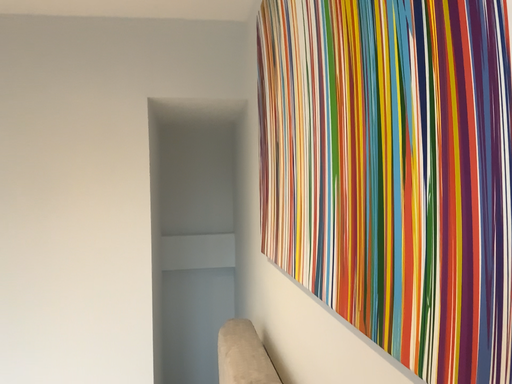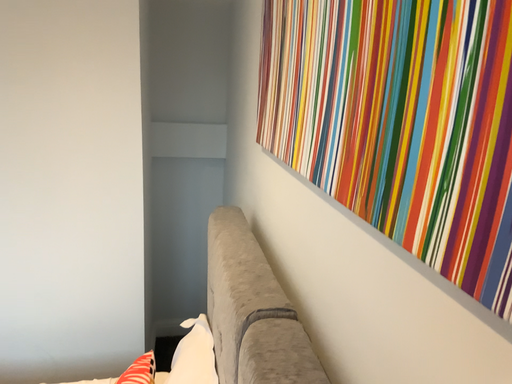
Question: Which way did the camera rotate in the video?

Choices:
 (A) rotated upward
 (B) rotated downward

Answer: (B)